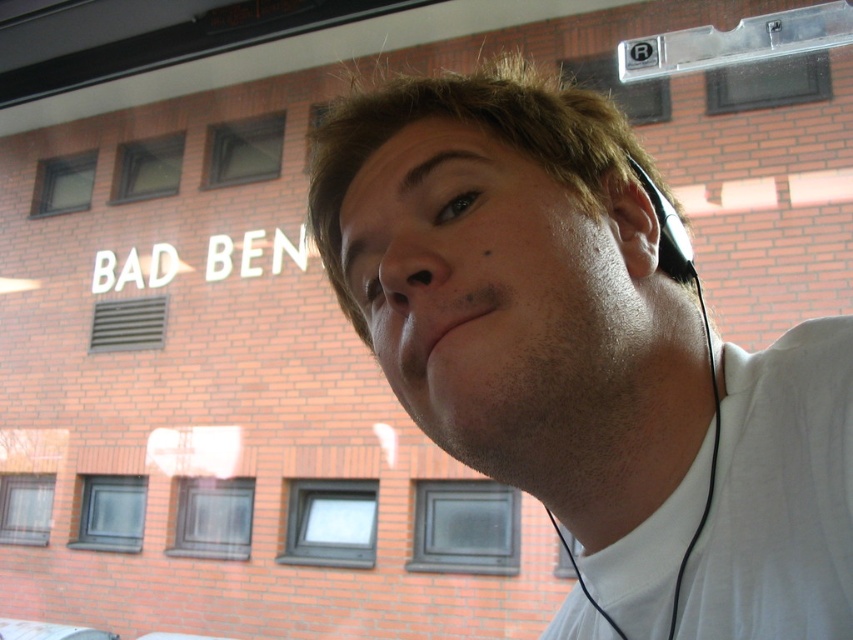
You are a window installer checking the positions of windows on a building. You see the black glass window at center and the clear glass window at lower left. Which window is located to the right of the other?

The black glass window at center is positioned on the right side of clear glass window at lower left.

You are standing in front of the brick building and notice two windows. Based on their positions, which window is more to the left? The black glass window at center or the transparent glass window at upper left?

The transparent glass window at upper left is more to the left because the black glass window at center is positioned on the right side of it.